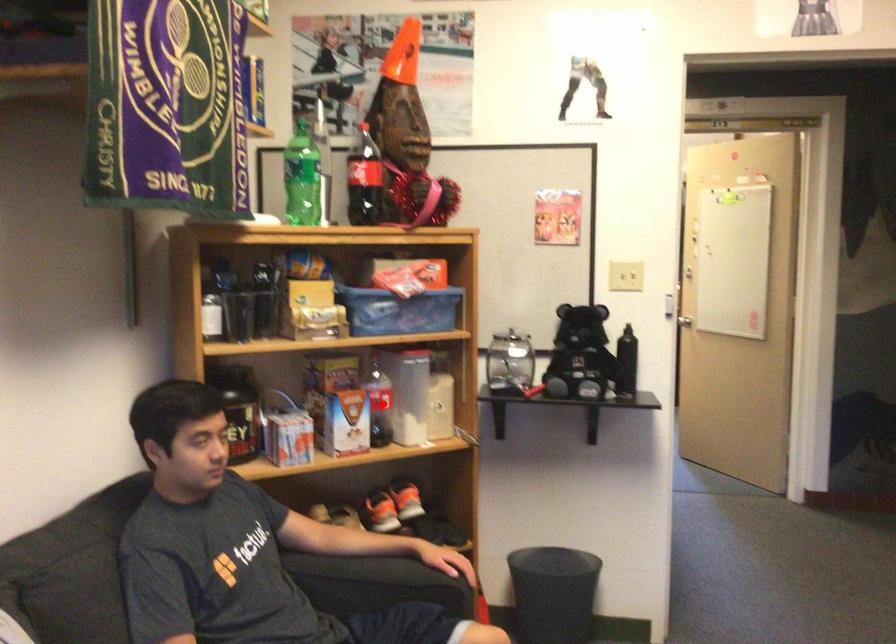
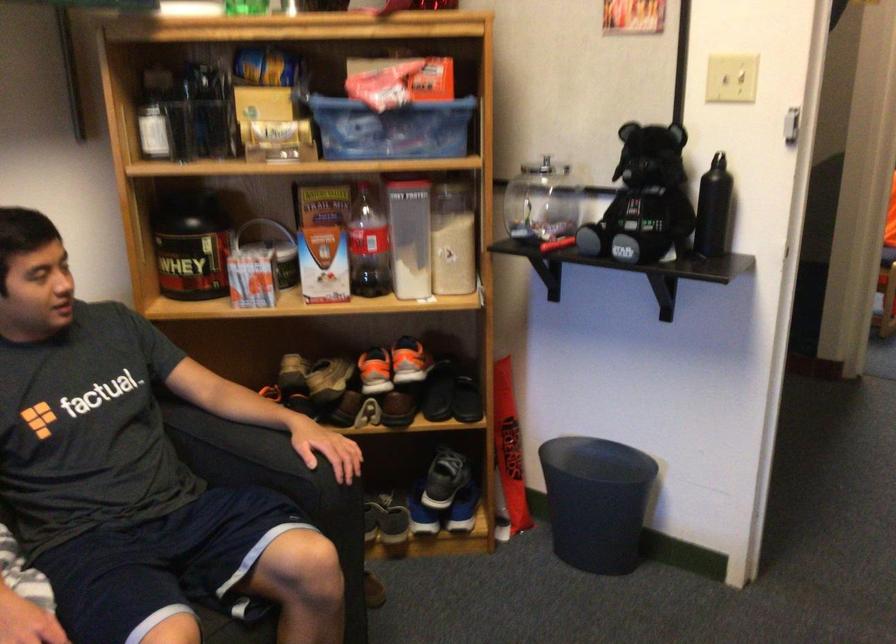
Question: I am providing you with two images of the same scene from different viewpoints. A red point is shown in image1. For the corresponding object point in image2, is it positioned nearer or farther from the camera?

Choices:
 (A) Nearer
 (B) Farther

Answer: (A)